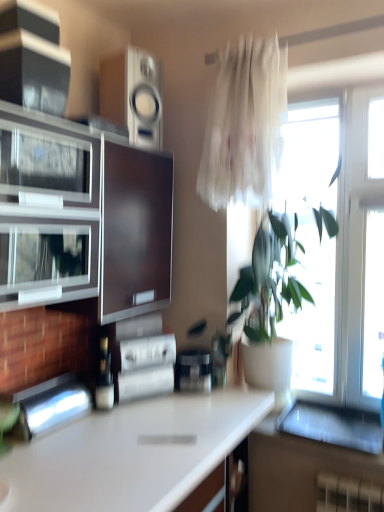
Question: Would you say black glossy speaker at upper left, marked as the 4th appliance in a bottom-to-top arrangement, is part of shiny metallic bottle at center's contents?

Choices:
 (A) yes
 (B) no

Answer: (B)

Question: Could you tell me if shiny metallic bottle at center is turned towards black glossy speaker at upper left, acting as the second appliance starting from the top?

Choices:
 (A) no
 (B) yes

Answer: (A)

Question: Is shiny metallic bottle at center taller than black glossy speaker at upper left, acting as the second appliance starting from the top?

Choices:
 (A) yes
 (B) no

Answer: (A)

Question: Is shiny metallic bottle at center looking in the opposite direction of black glossy speaker at upper left, marked as the 4th appliance in a bottom-to-top arrangement?

Choices:
 (A) yes
 (B) no

Answer: (B)

Question: From the image's perspective, does shiny metallic bottle at center appear lower than black glossy speaker at upper left, acting as the second appliance starting from the top?

Choices:
 (A) yes
 (B) no

Answer: (A)

Question: From the image's perspective, is metallic stainless steel toaster at lower left, which is the 5th appliance from top to bottom, located above or below shiny metallic bottle at center?

Choices:
 (A) above
 (B) below

Answer: (B)

Question: Visually, is metallic stainless steel toaster at lower left, which ranks as the first appliance in bottom-to-top order, positioned to the left or to the right of shiny metallic bottle at center?

Choices:
 (A) right
 (B) left

Answer: (B)

Question: Is point (51, 426) closer or farther from the camera than point (102, 371)?

Choices:
 (A) farther
 (B) closer

Answer: (B)

Question: Based on their sizes in the image, would you say metallic stainless steel toaster at lower left, which is the 5th appliance from top to bottom, is bigger or smaller than shiny metallic bottle at center?

Choices:
 (A) small
 (B) big

Answer: (B)

Question: From a real-world perspective, is translucent white curtain at upper right above or below metallic stainless steel toaster at lower left, which ranks as the first appliance in bottom-to-top order?

Choices:
 (A) below
 (B) above

Answer: (B)

Question: Is translucent white curtain at upper right bigger or smaller than metallic stainless steel toaster at lower left, which ranks as the first appliance in bottom-to-top order?

Choices:
 (A) big
 (B) small

Answer: (A)

Question: From the image's perspective, is translucent white curtain at upper right located above or below metallic stainless steel toaster at lower left, which ranks as the first appliance in bottom-to-top order?

Choices:
 (A) above
 (B) below

Answer: (A)

Question: Does point (206, 176) appear closer or farther from the camera than point (26, 414)?

Choices:
 (A) farther
 (B) closer

Answer: (A)

Question: Relative to white glossy computer desk at lower right, is translucent white curtain at upper right in front or behind?

Choices:
 (A) behind
 (B) front

Answer: (A)

Question: From their relative heights in the image, would you say translucent white curtain at upper right is taller or shorter than white glossy computer desk at lower right?

Choices:
 (A) tall
 (B) short

Answer: (A)